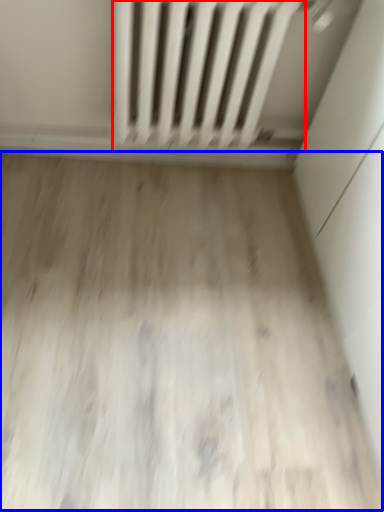
Question: Which object appears closest to the camera in this image, radiator (highlighted by a red box) or plain (highlighted by a blue box)?

Choices:
 (A) radiator
 (B) plain

Answer: (B)